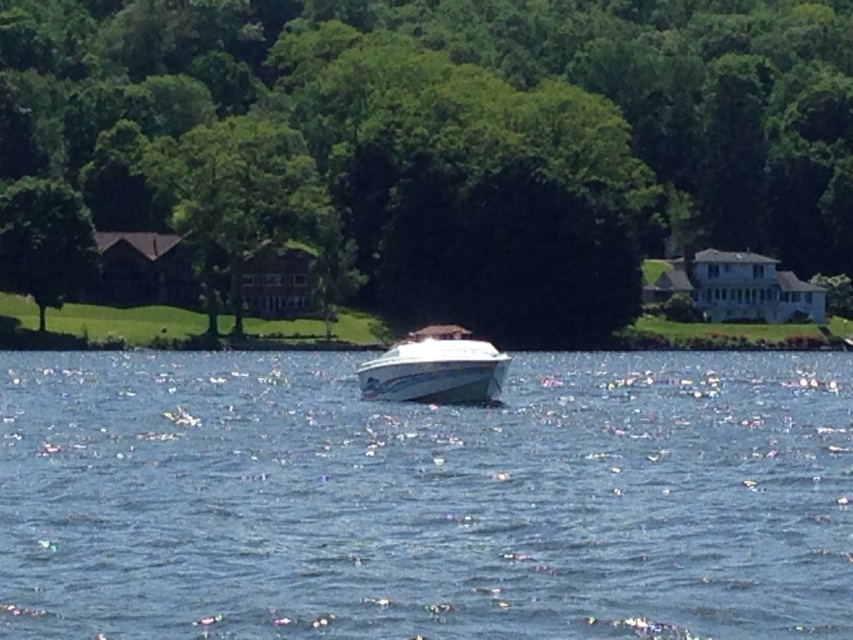
Question: Which object appears farthest from the camera in this image?

Choices:
 (A) blue water at center
 (B) green leafy tree at center
 (C) white glossy boat at center

Answer: (B)

Question: Can you confirm if blue water at center is positioned to the right of green leafy tree at left?

Choices:
 (A) yes
 (B) no

Answer: (A)

Question: Observing the image, what is the correct spatial positioning of green leafy tree at center in reference to white glossy boat at center?

Choices:
 (A) above
 (B) below

Answer: (A)

Question: Which object is positioned closest to the blue water at center?

Choices:
 (A) green leafy tree at upper center
 (B) green leafy tree at center
 (C) white glossy boat at center
 (D) green leafy tree at left

Answer: (C)

Question: Does blue water at center appear over white glossy boat at center?

Choices:
 (A) yes
 (B) no

Answer: (B)

Question: Based on their relative distances, which object is nearer to the green leafy tree at left?

Choices:
 (A) green leafy tree at center
 (B) green leafy tree at upper center
 (C) white glossy boat at center
 (D) blue water at center

Answer: (B)